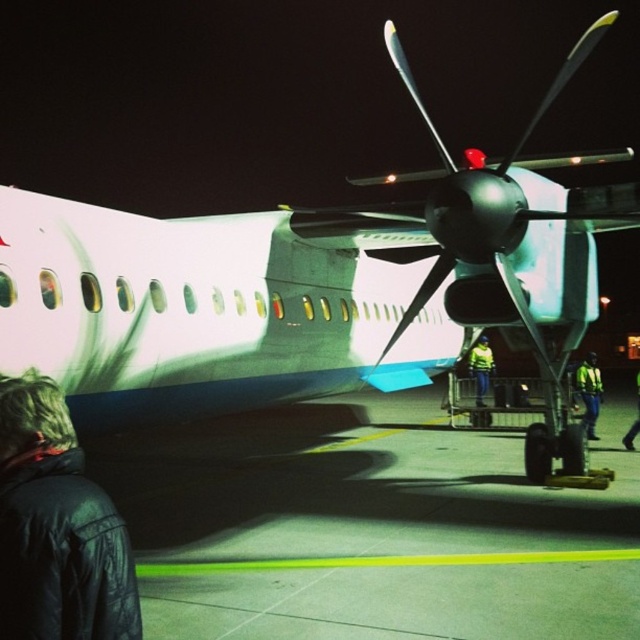
Question: Is yellow reflective vest at center to the right of yellow reflective vest at lower right from the viewer's perspective?

Choices:
 (A) yes
 (B) no

Answer: (B)

Question: Where is black leather jacket at lower left located in relation to yellow reflective vest at center in the image?

Choices:
 (A) right
 (B) left

Answer: (B)

Question: Which point is farther to the camera?

Choices:
 (A) (481, 362)
 (B) (628, 444)
 (C) (80, 554)
 (D) (593, 381)

Answer: (A)

Question: Among these objects, which one is nearest to the camera?

Choices:
 (A) yellow reflective vest at lower right
 (B) yellow reflective vest at center

Answer: (A)

Question: Can you confirm if black leather jacket at lower left is bigger than yellow reflective vest at center?

Choices:
 (A) no
 (B) yes

Answer: (A)

Question: Which point is farther to the camera?

Choices:
 (A) (20, 522)
 (B) (627, 442)
 (C) (579, 384)
 (D) (480, 388)

Answer: (D)